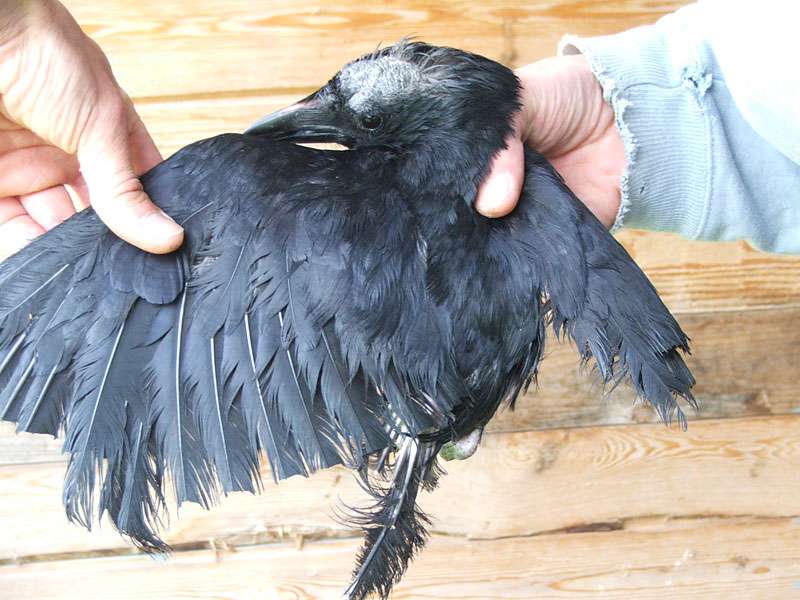
The width and height of the screenshot is (800, 600). I want to click on light brown hardwood surface, so click(x=226, y=46).